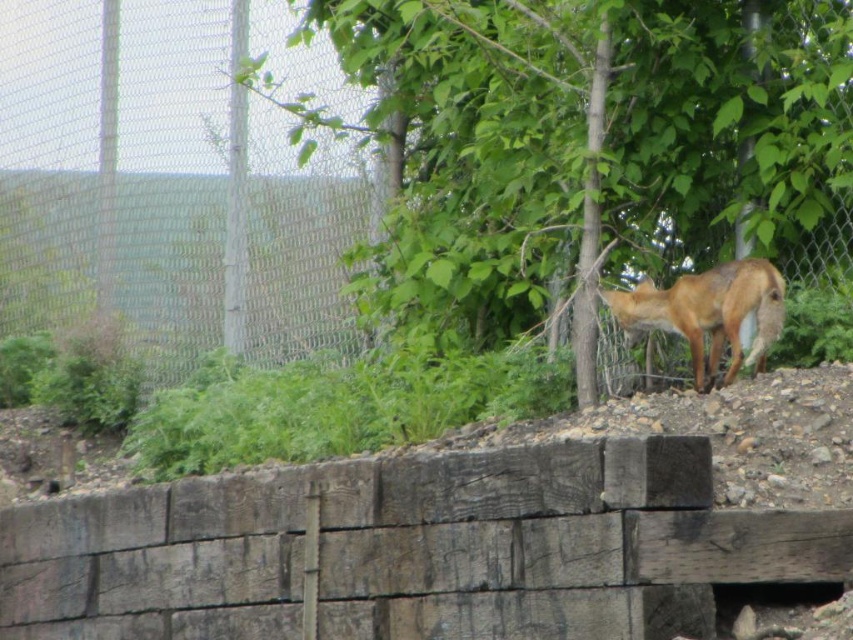
You are a hiker trying to take a photo of the brown fur fox at center. You want to ensure the green leafy tree at right doesn

The green leafy tree at right is much taller than the brown fur fox at center, so if you position yourself so the tree is behind the fox, the fox will appear smaller in comparison, making it easier to frame the shot with the tree as a backdrop without overshadowing the fox.